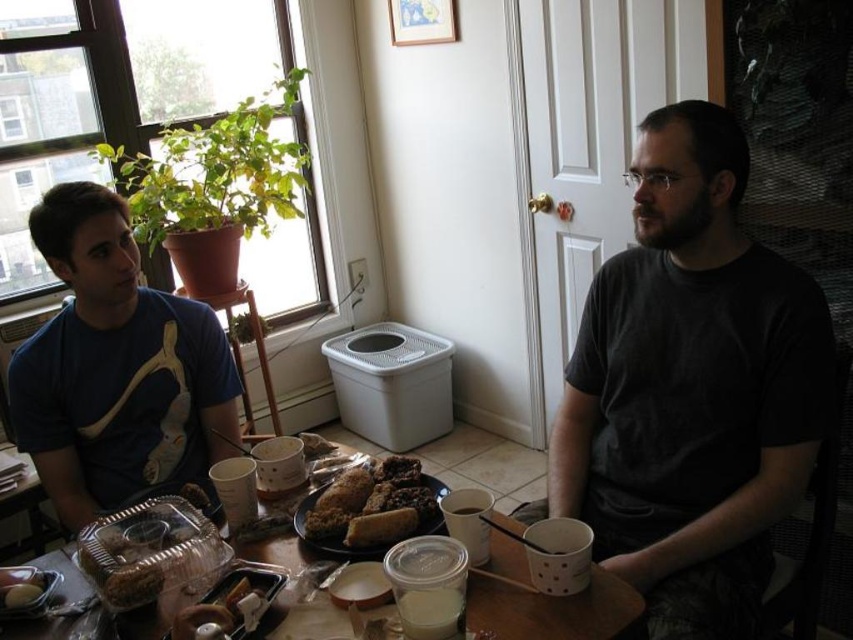
Does dark gray t-shirt at center have a lesser width compared to slightly toasted bread at center?

No, dark gray t-shirt at center is not thinner than slightly toasted bread at center.

Identify the location of dark gray t-shirt at center. (691, 387).

Does chocolate cake at center appear under slightly toasted bread at center?

No.

Between point (341, 499) and point (215, 614), which one is positioned in front?

Point (215, 614) is more forward.

Based on the photo, who is more distant from viewer, (392,477) or (223,628)?

The point (392,477) is more distant.

Where is `chocolate cake at center`? This screenshot has width=853, height=640. chocolate cake at center is located at coordinates (370, 504).

Is clear plastic table at center wider than slightly toasted bread at center?

Correct, the width of clear plastic table at center exceeds that of slightly toasted bread at center.

What do you see at coordinates (552, 611) in the screenshot?
I see `clear plastic table at center` at bounding box center [552, 611].

The height and width of the screenshot is (640, 853). What do you see at coordinates (552, 611) in the screenshot?
I see `clear plastic table at center` at bounding box center [552, 611].

Image resolution: width=853 pixels, height=640 pixels. In order to click on clear plastic table at center in this screenshot , I will do `click(552, 611)`.